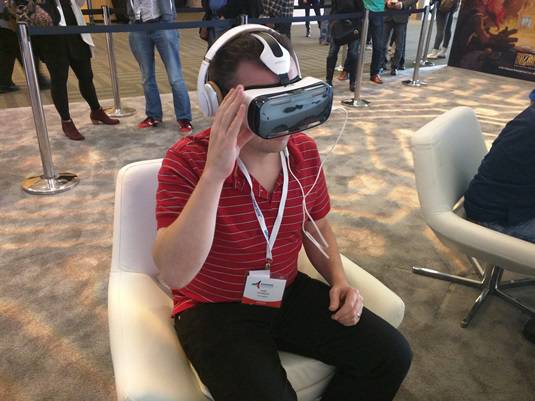
Where is `chair legs`? This screenshot has height=401, width=535. chair legs is located at coordinates (485, 288).